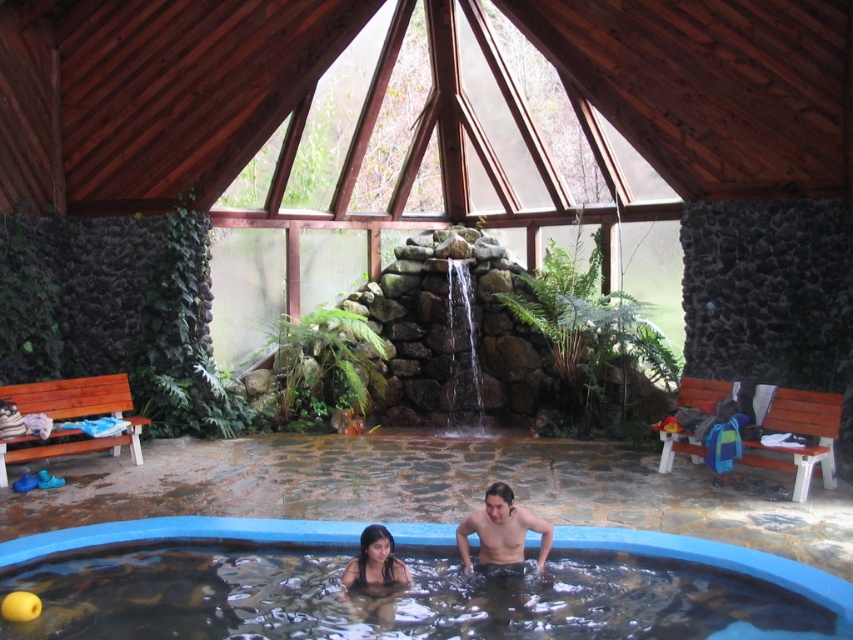
You are a guest at the spa and want to avoid getting your hair wet. The smooth black hair at lower center is part of a sculpture. Can you stand in the blue smooth pool at center without getting the sculpture hair wet?

The blue smooth pool at center is below smooth black hair at lower center, so standing in the pool won not get the sculpture hair wet since the pool is positioned lower than the hair.

You are a photographer positioned at the entrance of the spa. You want to capture a clear photo of the smooth skin man at center without the smooth black hair at lower center blocking the view. Is this possible?

The smooth black hair at lower center is behind the smooth skin man at center, so taking a clear photo of the smooth skin man at center without the smooth black hair at lower center blocking the view is possible.